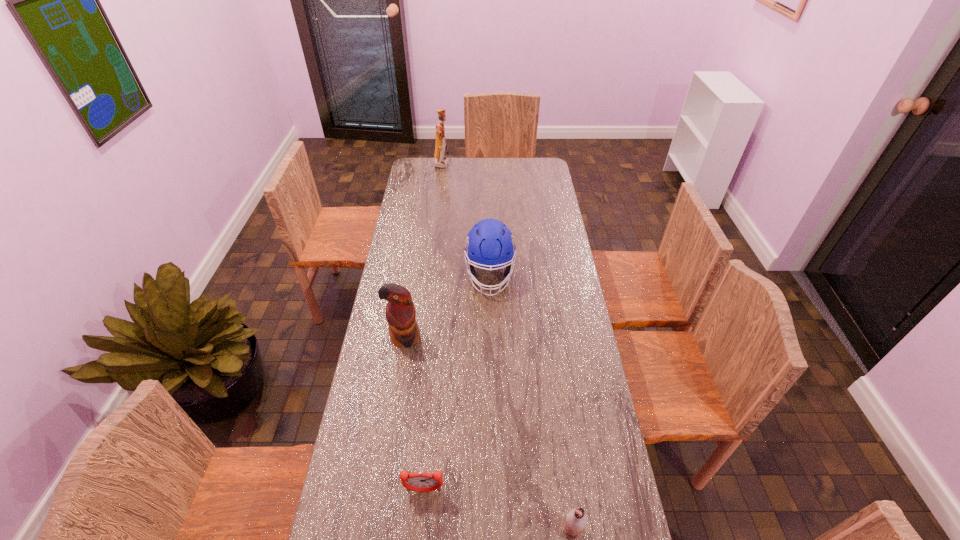
Identify the location of nutcracker. (440, 161).

This screenshot has height=540, width=960. In order to click on the third nearest object in this screenshot , I will do `click(400, 312)`.

Find the location of a particular element. The image size is (960, 540). the fourth nearest object is located at coordinates (490, 244).

This screenshot has width=960, height=540. I want to click on the second object from right to left, so click(x=490, y=244).

Where is `alarm clock`? alarm clock is located at coordinates (420, 481).

Locate an element on the screen. Image resolution: width=960 pixels, height=540 pixels. the fourth farthest object is located at coordinates (420, 481).

What are the coordinates of `free region located 0.300m on the front-facing side of the nutcracker` in the screenshot? It's located at (502, 164).

I want to click on free space located on the face of the third nearest object, so click(x=398, y=379).

Where is `free space located on the front-facing side of the fourth object from left to right`? Image resolution: width=960 pixels, height=540 pixels. free space located on the front-facing side of the fourth object from left to right is located at coordinates (492, 343).

Where is `free space located on the front-facing side of the second nearest object`? The width and height of the screenshot is (960, 540). free space located on the front-facing side of the second nearest object is located at coordinates (421, 519).